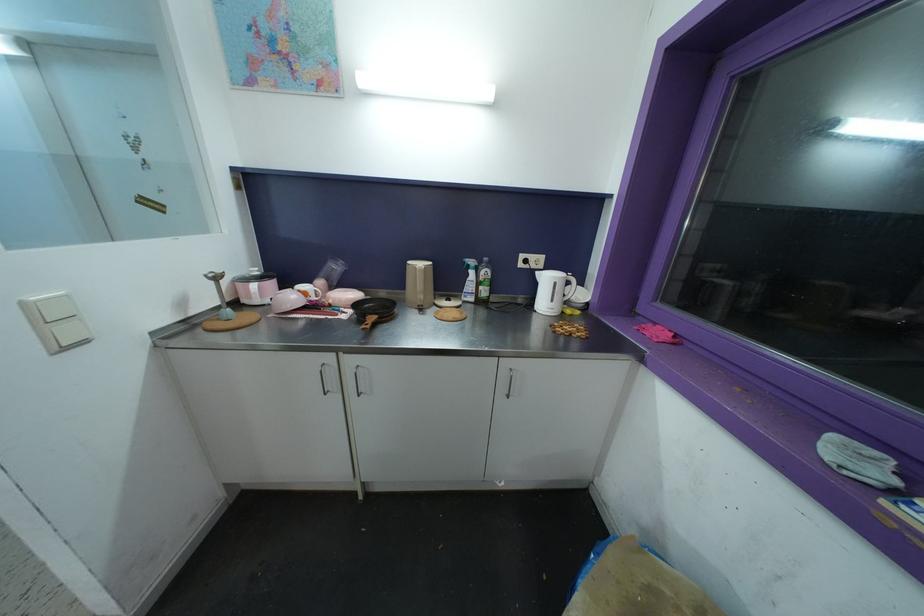
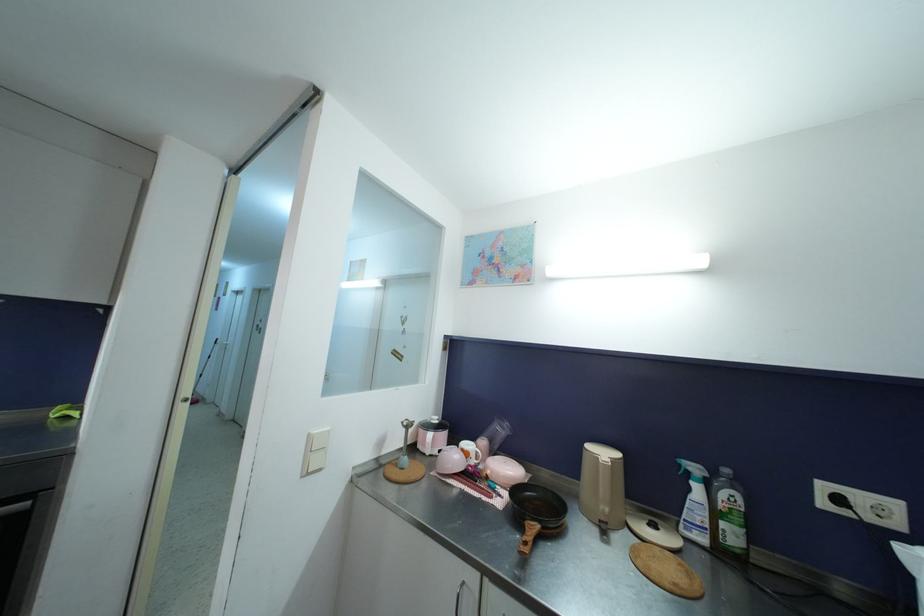
The point at (433, 265) is marked in the first image. Where is the corresponding point in the second image?

(623, 458)